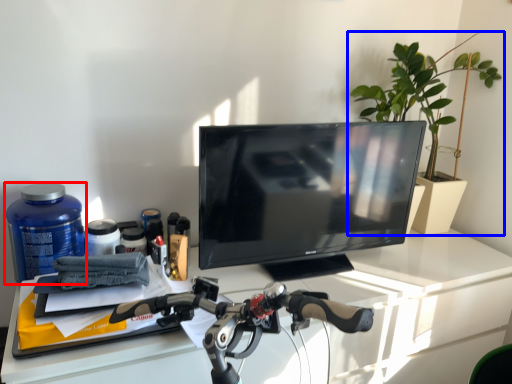
Question: Which point is further to the camera, bottle (highlighted by a red box) or houseplant (highlighted by a blue box)?

Choices:
 (A) bottle
 (B) houseplant

Answer: (B)